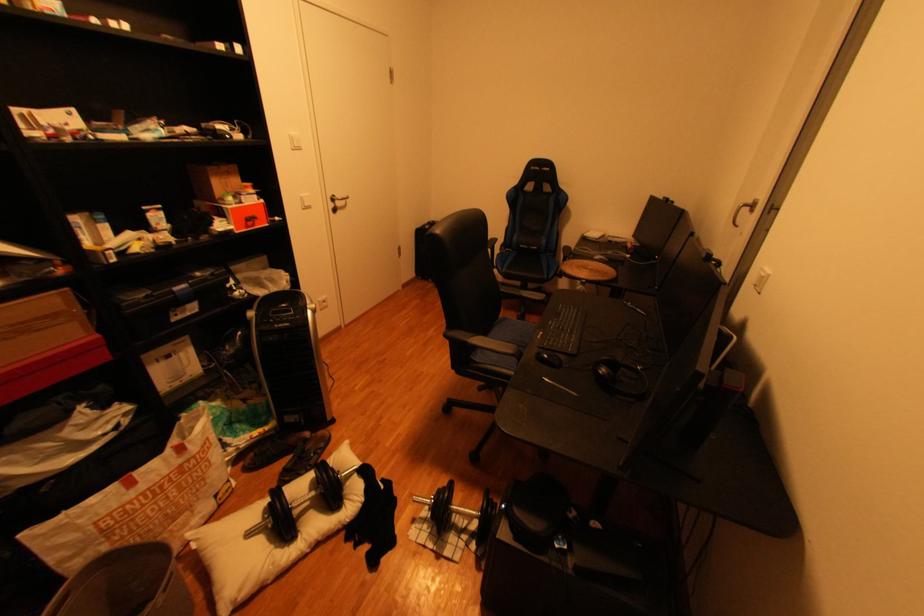
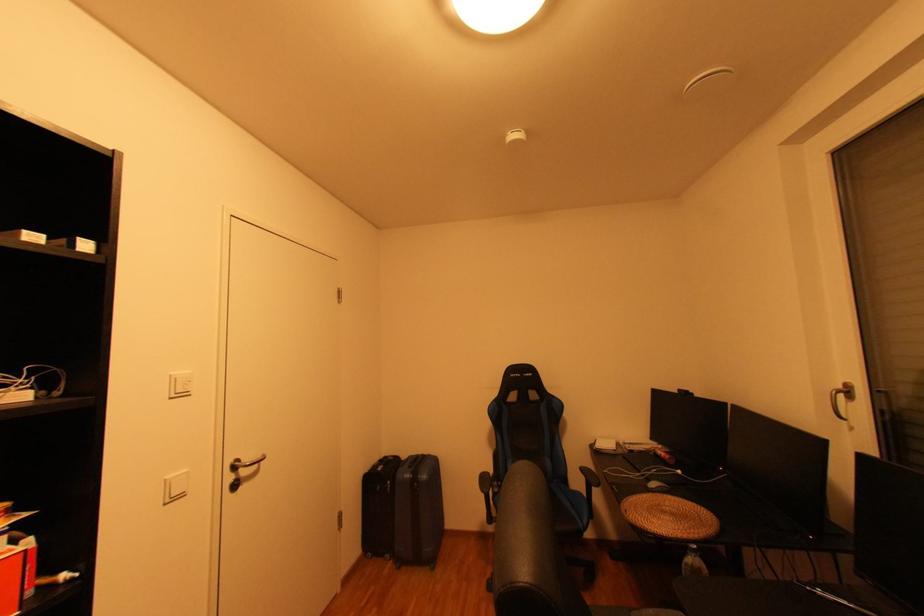
Find the pixel in the second image that matches pixel 597 269 in the first image.

(674, 513)